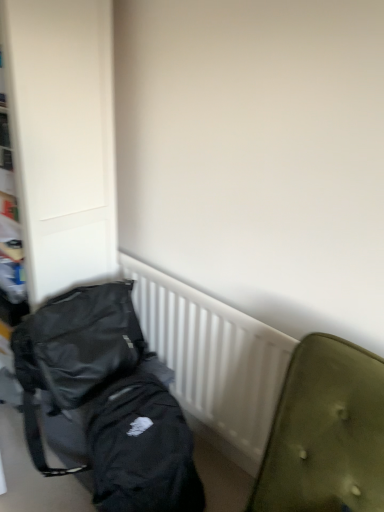
Question: Considering the relative positions of black fabric backpack at left and white plastic radiator at center in the image provided, is black fabric backpack at left to the right of white plastic radiator at center from the viewer's perspective?

Choices:
 (A) no
 (B) yes

Answer: (A)

Question: Is black fabric backpack at left located outside white plastic radiator at center?

Choices:
 (A) no
 (B) yes

Answer: (B)

Question: Could you tell me if black fabric backpack at left is turned towards white plastic radiator at center?

Choices:
 (A) no
 (B) yes

Answer: (A)

Question: Does black fabric backpack at left have a lesser height compared to white plastic radiator at center?

Choices:
 (A) no
 (B) yes

Answer: (A)

Question: Is black fabric backpack at left beside white plastic radiator at center?

Choices:
 (A) no
 (B) yes

Answer: (A)

Question: From the image's perspective, is white plastic radiator at center above or below black fabric backpack at left?

Choices:
 (A) below
 (B) above

Answer: (A)

Question: From a real-world perspective, is white plastic radiator at center positioned above or below black fabric backpack at left?

Choices:
 (A) below
 (B) above

Answer: (A)

Question: In terms of size, does white plastic radiator at center appear bigger or smaller than black fabric backpack at left?

Choices:
 (A) big
 (B) small

Answer: (B)

Question: Is white plastic radiator at center situated inside black fabric backpack at left or outside?

Choices:
 (A) inside
 (B) outside

Answer: (B)

Question: Relative to black matte backpack at lower left, is white plastic radiator at center in front or behind?

Choices:
 (A) behind
 (B) front

Answer: (A)

Question: Does point (190, 345) appear closer or farther from the camera than point (49, 353)?

Choices:
 (A) closer
 (B) farther

Answer: (B)

Question: Do you think white plastic radiator at center is within black matte backpack at lower left, or outside of it?

Choices:
 (A) outside
 (B) inside

Answer: (A)

Question: From a real-world perspective, is white plastic radiator at center above or below black matte backpack at lower left?

Choices:
 (A) below
 (B) above

Answer: (A)

Question: Is black fabric backpack at left bigger or smaller than black matte backpack at lower left?

Choices:
 (A) small
 (B) big

Answer: (B)

Question: Do you think black fabric backpack at left is within black matte backpack at lower left, or outside of it?

Choices:
 (A) inside
 (B) outside

Answer: (B)